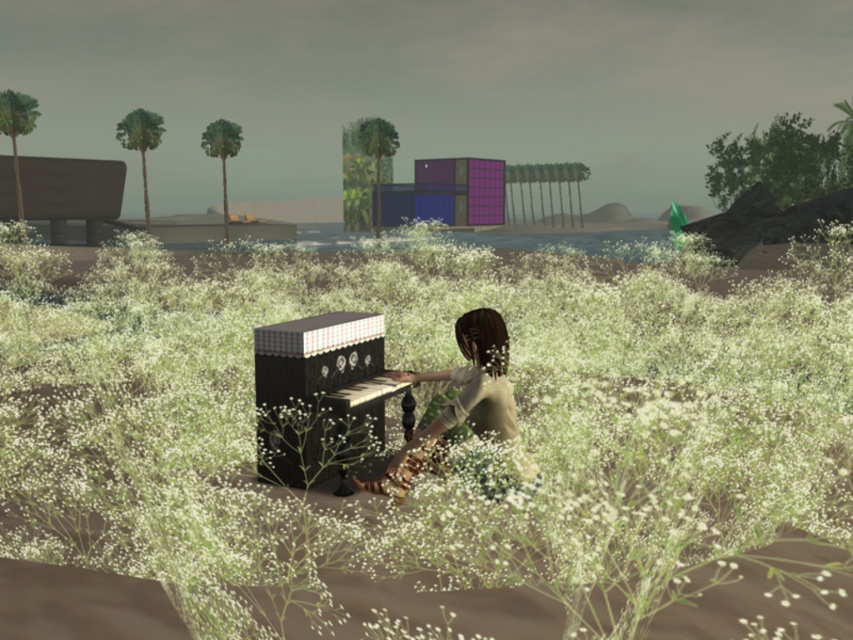
Can you confirm if white fluffy grass at center is wider than matte brown hair at center?

Correct, the width of white fluffy grass at center exceeds that of matte brown hair at center.

What do you see at coordinates (450, 449) in the screenshot?
I see `white fluffy grass at center` at bounding box center [450, 449].

Locate an element on the screen. This screenshot has height=640, width=853. white fluffy grass at center is located at coordinates (450, 449).